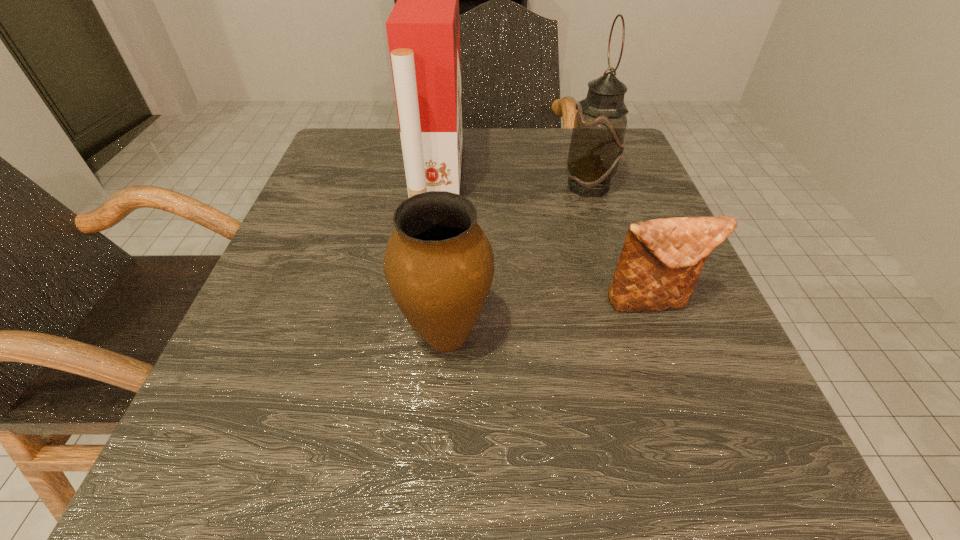
Select which object appears as the third closest to the oil lamp. Please provide its 2D coordinates. Your answer should be formatted as a tuple, i.e. [(x, y)], where the tuple contains the x and y coordinates of a point satisfying the conditions above.

[(439, 264)]

I want to click on the closest object relative to the second shortest object, so click(x=661, y=260).

The height and width of the screenshot is (540, 960). What are the coordinates of `free location that satisfies the following two spatial constraints: 1. on the front-facing side of the second shortest object; 2. on the left side of the cigarette case` in the screenshot? It's located at (419, 334).

I want to click on blank area in the image that satisfies the following two spatial constraints: 1. on the front-facing side of the cigarette case; 2. on the back side of the second shortest object, so click(x=419, y=334).

Image resolution: width=960 pixels, height=540 pixels. What are the coordinates of `vacant region that satisfies the following two spatial constraints: 1. on the front-facing side of the second shortest object; 2. on the left side of the cigarette case` in the screenshot? It's located at (419, 334).

This screenshot has height=540, width=960. I want to click on blank space that satisfies the following two spatial constraints: 1. on the front-facing side of the cigarette case; 2. on the left side of the second shortest object, so click(x=419, y=334).